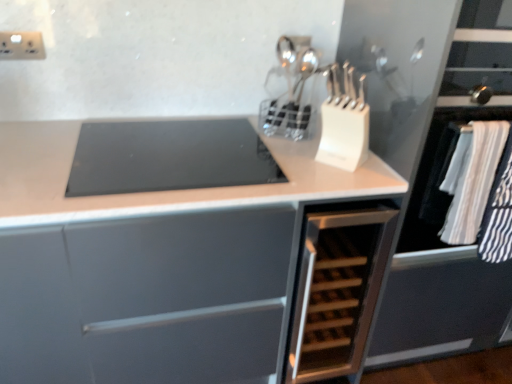
Identify the location of free location in front of white plastic knife block at upper center. (330, 184).